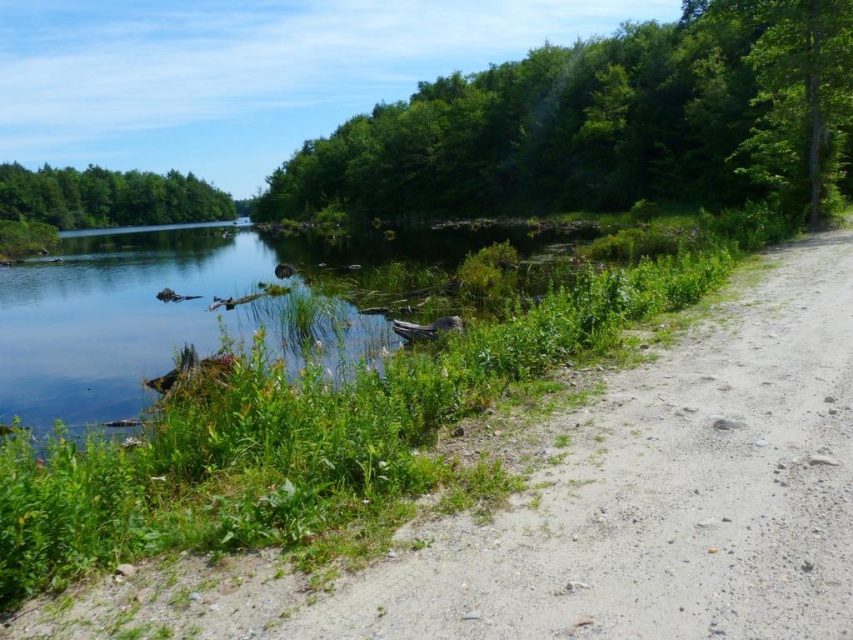
You are a hiker on the dirt path and want to know which tree is closer to you. The green leafy tree at upper right and the green matte tree at upper left are both in your view. Which one is nearer?

The green leafy tree at upper right is smaller than the green matte tree at upper left, so it is closer to you because smaller objects in the foreground appear smaller than those in the background.

You are standing at the point marked as point (x=605, y=125) in the image. Which direction should you walk to reach the dirt path that runs parallel to the water?

The point (x=605, y=125) is on a green leafy tree at upper right. To reach the dirt path parallel to the water, you should walk downward from the tree towards the lower part of the image where the path is located.